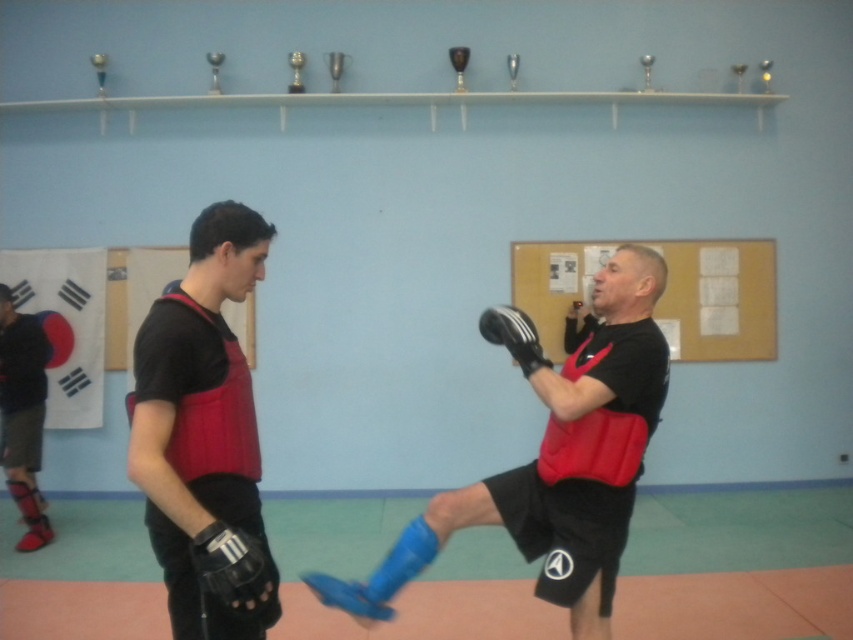
What do you see at coordinates (22, 413) in the screenshot? I see `matte black shin guard at lower left` at bounding box center [22, 413].

Which is more to the left, matte black shin guard at lower left or black synthetic boxing glove at center?

matte black shin guard at lower left is more to the left.

The width and height of the screenshot is (853, 640). I want to click on matte black shin guard at lower left, so click(22, 413).

This screenshot has width=853, height=640. Find the location of `black leather boxing glove at lower left`. black leather boxing glove at lower left is located at coordinates (233, 568).

Is black leather boxing glove at lower left smaller than black synthetic boxing glove at center?

Correct, black leather boxing glove at lower left occupies less space than black synthetic boxing glove at center.

Does point (247, 536) come behind point (538, 362)?

No, it is in front of (538, 362).

At what (x,y) coordinates should I click in order to perform the action: click on black leather boxing glove at lower left. Please return your answer as a coordinate pair (x, y). This screenshot has height=640, width=853. Looking at the image, I should click on (233, 568).

Who is taller, black leather boxing glove at lower left or blue leather boxing glove at lower center?

blue leather boxing glove at lower center is taller.

The width and height of the screenshot is (853, 640). I want to click on black leather boxing glove at lower left, so click(233, 568).

The image size is (853, 640). Find the location of `black leather boxing glove at lower left`. black leather boxing glove at lower left is located at coordinates (233, 568).